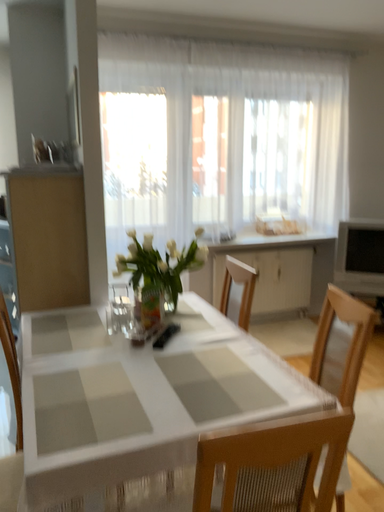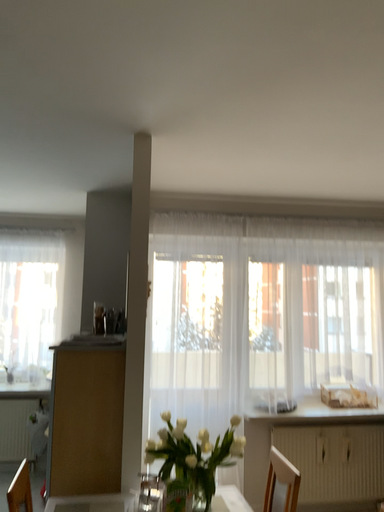
Question: Which way did the camera rotate in the video?

Choices:
 (A) rotated right
 (B) rotated left

Answer: (B)